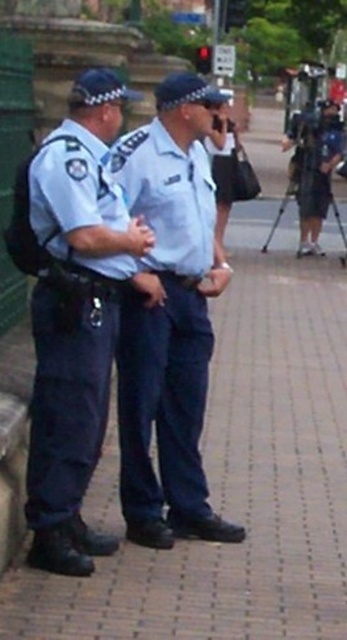
Can you confirm if blue uniform at center is positioned below matte blue uniform at left?

No.

The height and width of the screenshot is (640, 347). What do you see at coordinates (165, 323) in the screenshot?
I see `blue uniform at center` at bounding box center [165, 323].

This screenshot has width=347, height=640. I want to click on blue uniform at center, so click(x=165, y=323).